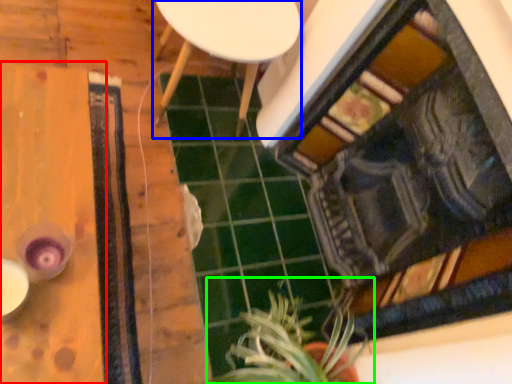
Question: Which is farther away from table (highlighted by a red box)? furniture (highlighted by a blue box) or houseplant (highlighted by a green box)?

Choices:
 (A) furniture
 (B) houseplant

Answer: (B)